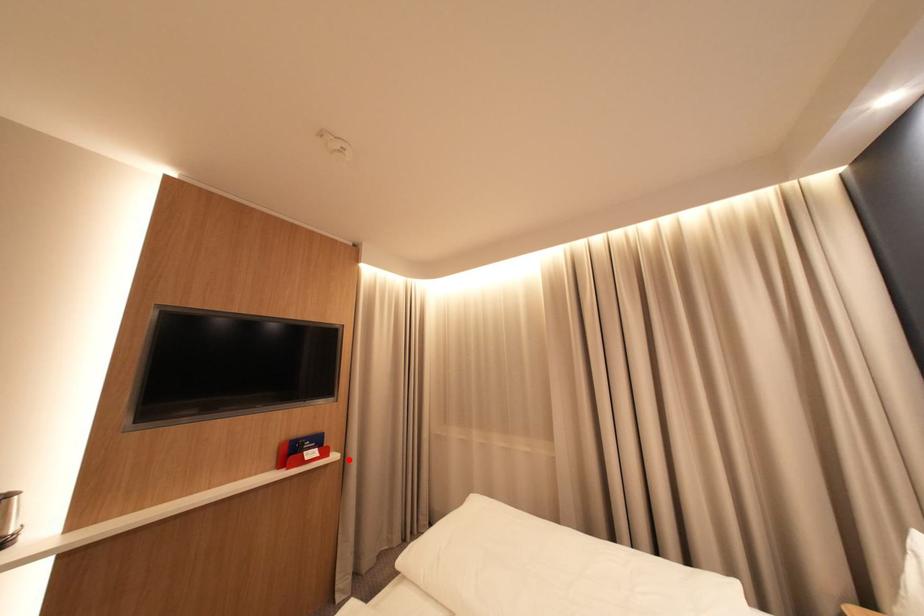
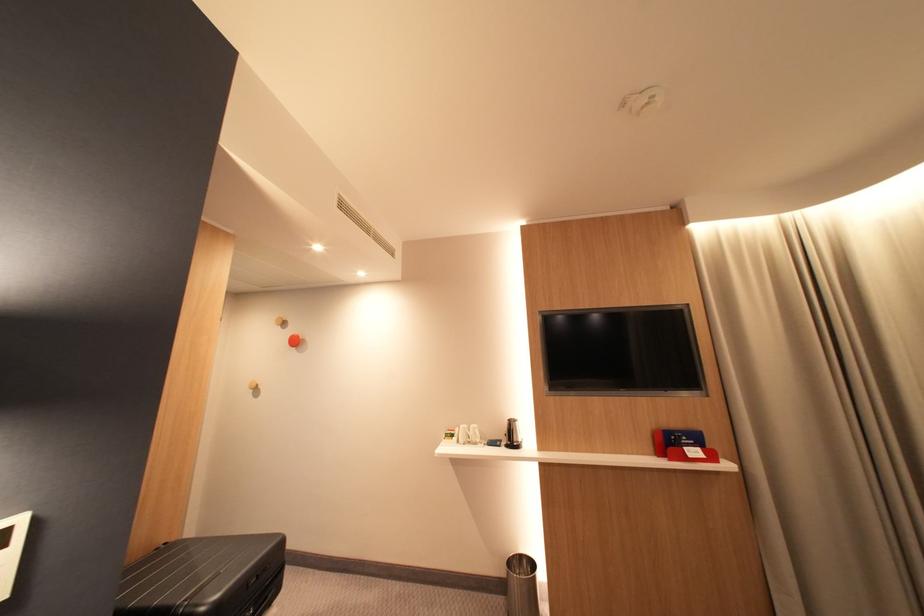
Question: I am providing you with two images of the same scene from different viewpoints. Image1 has a red point marked. In image2, the corresponding 3D location appears at what relative position? Reply with the corresponding letter.

Choices:
 (A) Closer
 (B) Farther

Answer: (A)